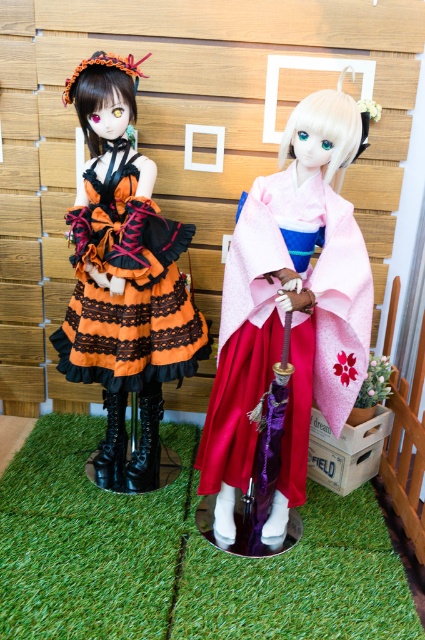
Question: Is pink satin kimono at center further to the viewer compared to orange satin dress at left?

Choices:
 (A) yes
 (B) no

Answer: (B)

Question: Is pink satin kimono at center positioned before orange satin dress at left?

Choices:
 (A) no
 (B) yes

Answer: (B)

Question: Does pink satin kimono at center have a smaller size compared to orange satin dress at left?

Choices:
 (A) no
 (B) yes

Answer: (A)

Question: Which of the following is the closest to the observer?

Choices:
 (A) orange satin dress at left
 (B) pink satin kimono at center

Answer: (B)

Question: Which object appears closest to the camera in this image?

Choices:
 (A) orange satin dress at left
 (B) pink satin kimono at center

Answer: (B)